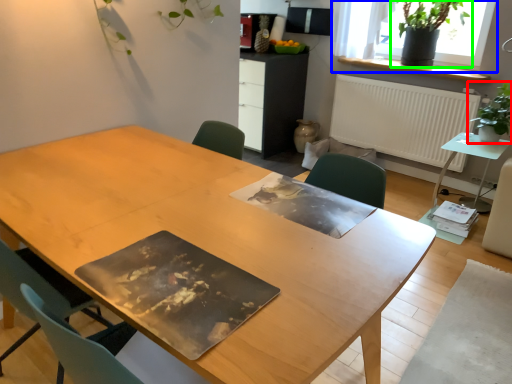
Question: Based on their relative distances, which object is nearer to houseplant (highlighted by a red box)? Choose from window (highlighted by a blue box) and houseplant (highlighted by a green box).

Choices:
 (A) window
 (B) houseplant

Answer: (A)